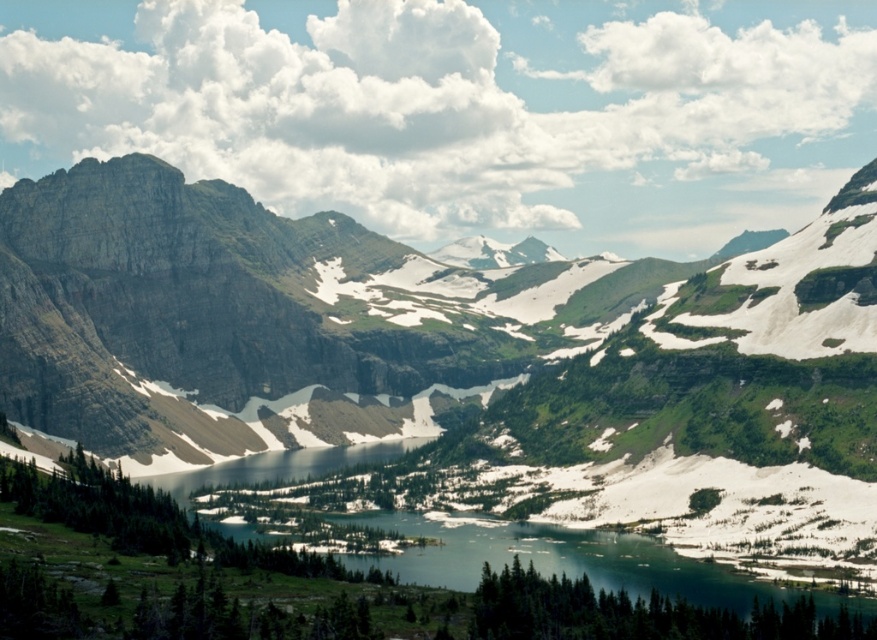
Between point (667, 282) and point (496, 540), which one is positioned behind?

The point (667, 282) is more distant.

Between rocky mountain range at left and clear blue water at center, which one has more height?

rocky mountain range at left

Who is more forward, (439, 330) or (868, 609)?

Positioned in front is point (868, 609).

This screenshot has width=877, height=640. I want to click on rocky mountain range at left, so click(x=262, y=312).